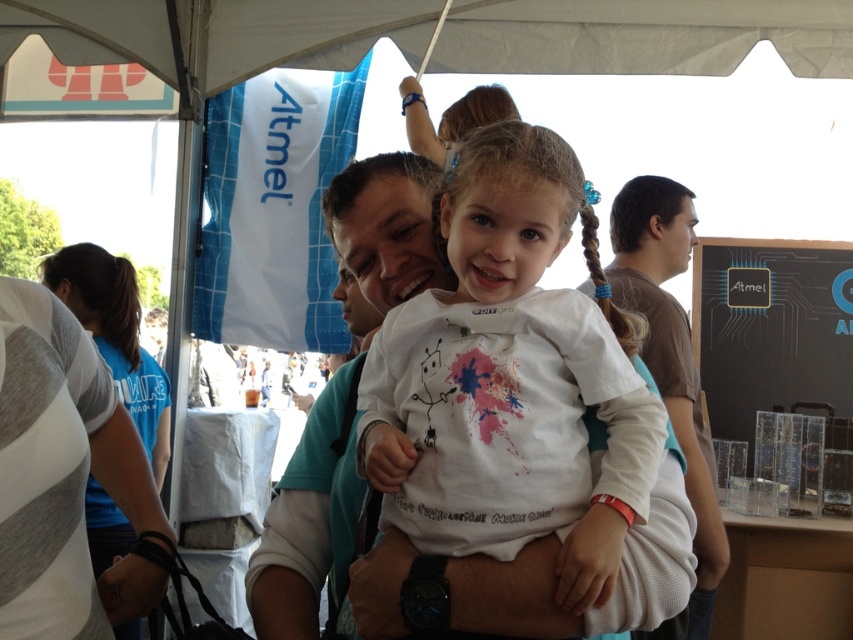
What do you see at coordinates (511, 378) in the screenshot?
I see `white cotton shirt at center` at bounding box center [511, 378].

This screenshot has width=853, height=640. What do you see at coordinates (511, 378) in the screenshot? I see `white cotton shirt at center` at bounding box center [511, 378].

I want to click on white cotton shirt at center, so click(x=511, y=378).

Can you confirm if brown cotton t-shirt at center is wider than blue braided hair at center?

Indeed, brown cotton t-shirt at center has a greater width compared to blue braided hair at center.

Does brown cotton t-shirt at center have a lesser height compared to blue braided hair at center?

In fact, brown cotton t-shirt at center may be taller than blue braided hair at center.

This screenshot has width=853, height=640. Find the location of `brown cotton t-shirt at center`. brown cotton t-shirt at center is located at coordinates (670, 365).

Where is `brown cotton t-shirt at center`? This screenshot has width=853, height=640. brown cotton t-shirt at center is located at coordinates [x=670, y=365].

In the scene shown: Can you confirm if white cotton shirt at center is smaller than blue braided hair at center?

No, white cotton shirt at center is not smaller than blue braided hair at center.

Which is in front, point (508, 330) or point (585, 216)?

Point (508, 330) is more forward.

You are a GUI agent. You are given a task and a screenshot of the screen. Output one action in this format:
    pyautogui.click(x=<x>, y=<y>)
    Task: Click on the white cotton shirt at center
    
    Given the screenshot: What is the action you would take?
    pyautogui.click(x=511, y=378)